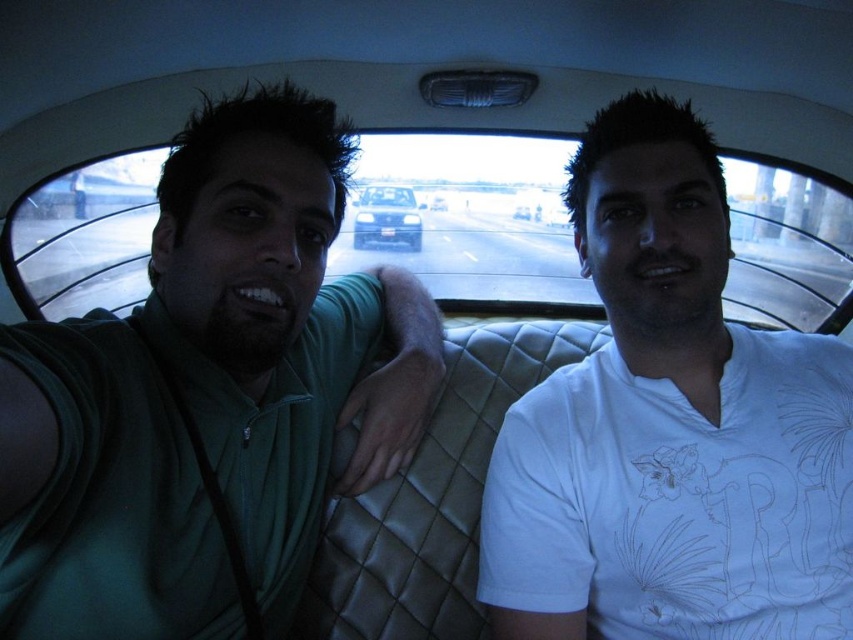
Question: Which object is closer to the camera taking this photo?

Choices:
 (A) black glossy car at center
 (B) metallic silver sedan at center
 (C) green fabric shirt at left
 (D) white matte shirt at right

Answer: (C)

Question: Is green fabric shirt at left positioned at the back of white matte shirt at right?

Choices:
 (A) no
 (B) yes

Answer: (A)

Question: Does green fabric shirt at left lie in front of black glossy car at center?

Choices:
 (A) no
 (B) yes

Answer: (B)

Question: Which of these objects is positioned farthest from the green fabric shirt at left?

Choices:
 (A) black glossy car at center
 (B) white matte shirt at right

Answer: (A)

Question: Which point is farther to the camera?

Choices:
 (A) (440, 196)
 (B) (286, 285)
 (C) (785, 516)

Answer: (A)

Question: Can you confirm if green fabric shirt at left is wider than white matte shirt at right?

Choices:
 (A) yes
 (B) no

Answer: (B)